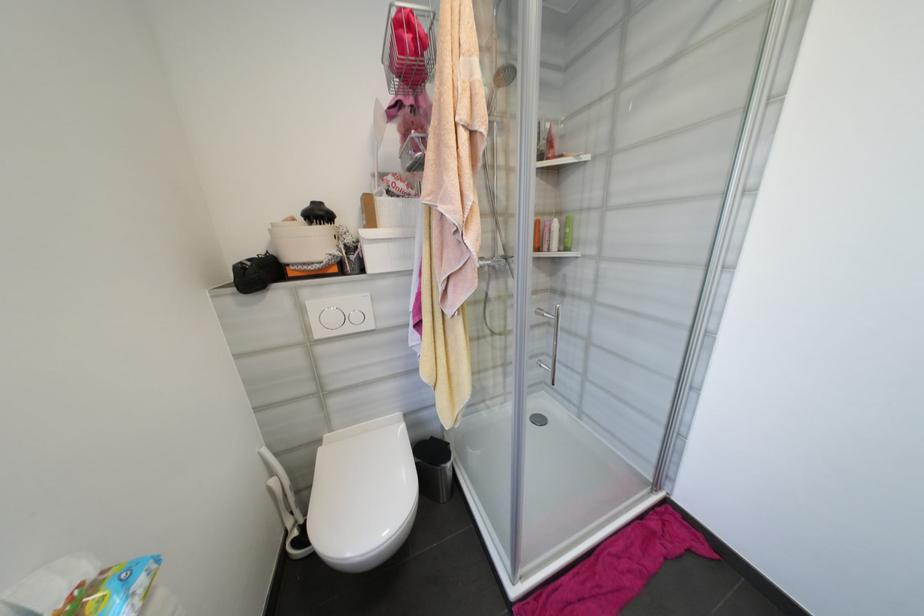
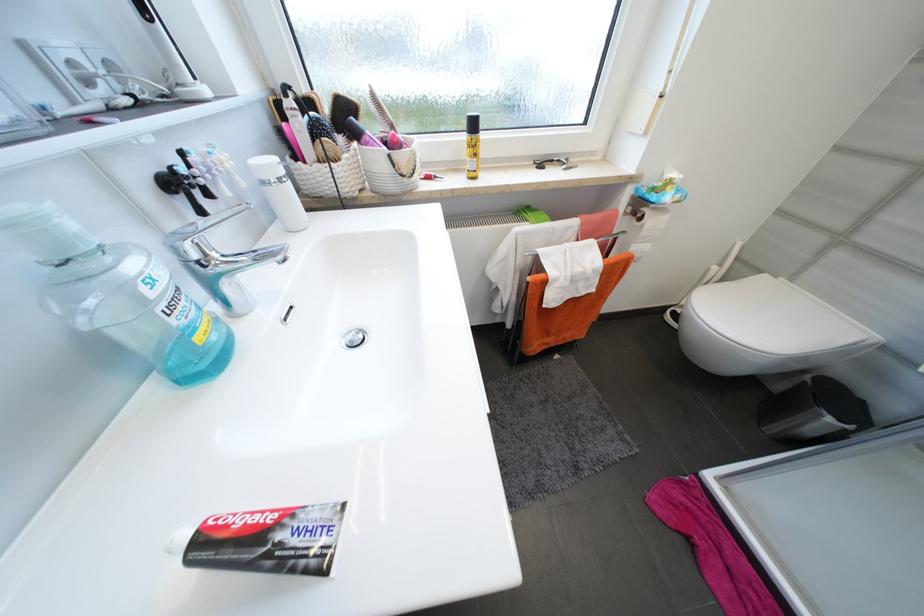
The point at (325,451) is marked in the first image. Where is the corresponding point in the second image?

(771, 277)